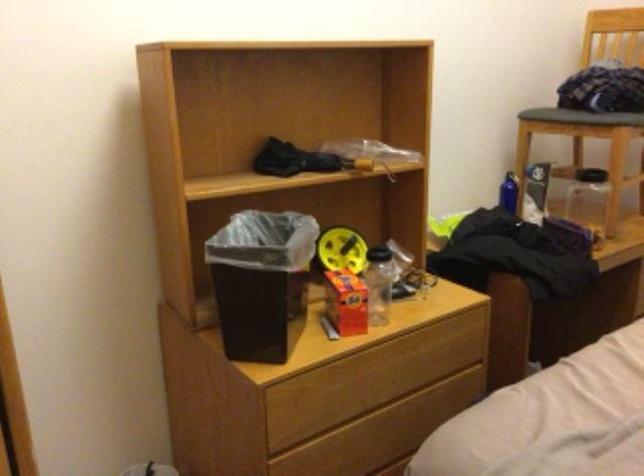
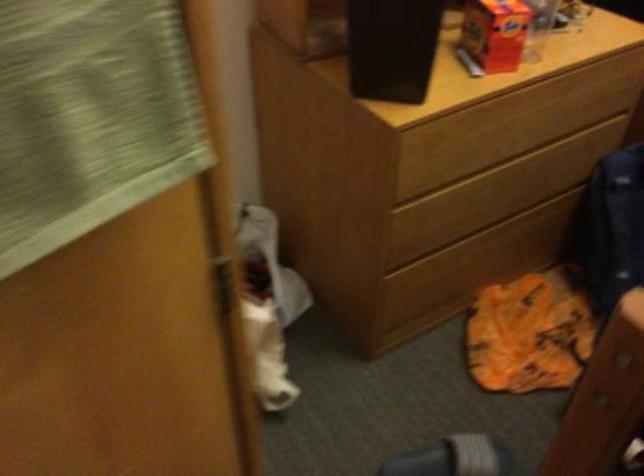
What movement of the cameraman would produce the second image?

The cameraman walked toward left, forward.